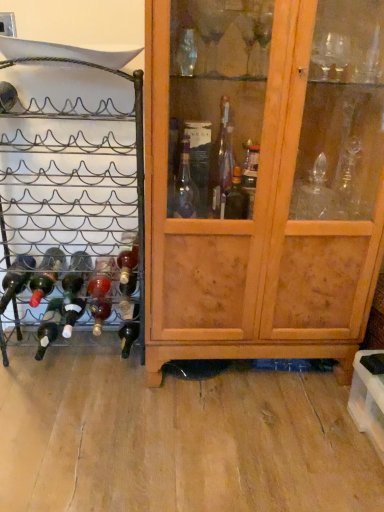
Image resolution: width=384 pixels, height=512 pixels. Find the location of `vacant region to the right of matte dark brown bottle at lower left, which is the sixth bottle from right to left`. vacant region to the right of matte dark brown bottle at lower left, which is the sixth bottle from right to left is located at coordinates point(92,354).